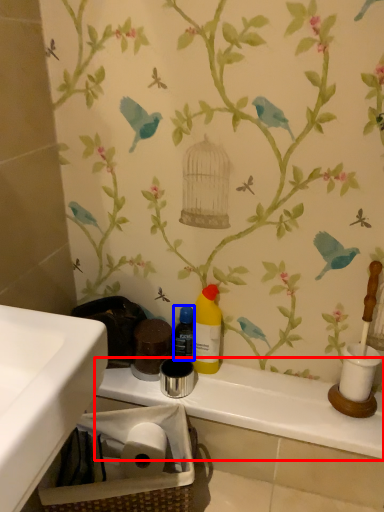
Question: Which object appears farthest to the camera in this image, counter top (highlighted by a red box) or bottle (highlighted by a blue box)?

Choices:
 (A) counter top
 (B) bottle

Answer: (B)